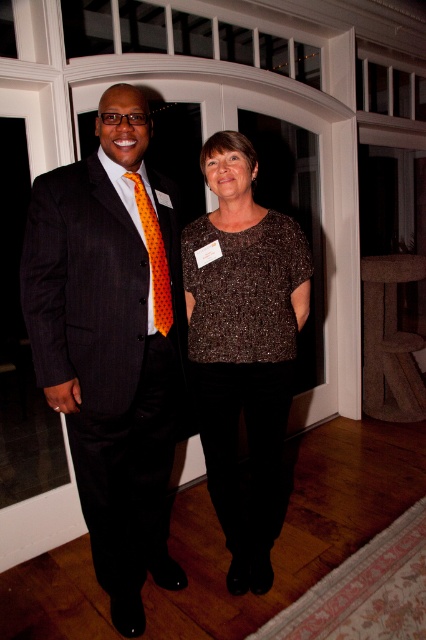
You are an event planner trying to place a decorative centerpiece on a table between the sparkly brown blouse at center and another object. To ensure proper alignment, which object should you use as a reference point for the center of the table?

The sparkly brown blouse at center is located at point (x=244, y=346), so you should use the sparkly brown blouse at center as the reference point for the center of the table.